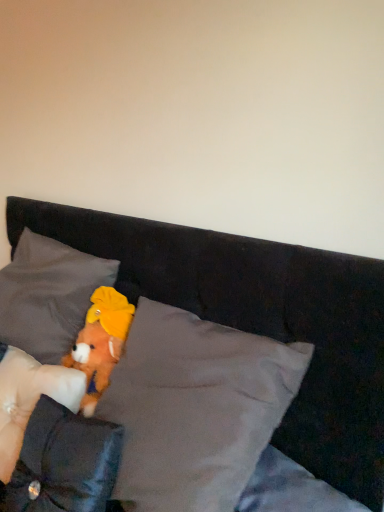
Question: Is dark gray plush pillow at left, the 3th pillow in the front-to-back sequence, positioned beyond the bounds of fluffy orange teddy bear at center?

Choices:
 (A) no
 (B) yes

Answer: (B)

Question: From a real-world perspective, is dark gray plush pillow at left, which is the first pillow from back to front, positioned under fluffy orange teddy bear at center based on gravity?

Choices:
 (A) yes
 (B) no

Answer: (B)

Question: Is dark gray plush pillow at left, the 3th pillow in the front-to-back sequence, oriented away from fluffy orange teddy bear at center?

Choices:
 (A) yes
 (B) no

Answer: (B)

Question: Can you confirm if dark gray plush pillow at left, the 3th pillow in the front-to-back sequence, is thinner than fluffy orange teddy bear at center?

Choices:
 (A) no
 (B) yes

Answer: (A)

Question: Is dark gray plush pillow at left, which is the first pillow from back to front, taller than fluffy orange teddy bear at center?

Choices:
 (A) yes
 (B) no

Answer: (A)

Question: Is dark gray plush pillow at left, which is the first pillow from back to front, inside or outside of fluffy orange teddy bear at center?

Choices:
 (A) inside
 (B) outside

Answer: (B)

Question: From the image's perspective, relative to fluffy orange teddy bear at center, is dark gray plush pillow at left, which is the first pillow from back to front, above or below?

Choices:
 (A) below
 (B) above

Answer: (B)

Question: Is point (43, 290) positioned closer to the camera than point (104, 313)?

Choices:
 (A) closer
 (B) farther

Answer: (B)

Question: From a real-world perspective, is dark gray plush pillow at left, which is the first pillow from back to front, above or below fluffy orange teddy bear at center?

Choices:
 (A) below
 (B) above

Answer: (B)

Question: Choose the correct answer: Is velvet gray pillow at lower left, the 1th pillow when ordered from front to back, inside soft white pillow at lower left, marked as the second pillow in a back-to-front arrangement, or outside it?

Choices:
 (A) outside
 (B) inside

Answer: (A)

Question: Considering the positions of velvet gray pillow at lower left, placed as the 3th pillow when sorted from back to front, and soft white pillow at lower left, marked as the second pillow in a back-to-front arrangement, in the image, is velvet gray pillow at lower left, placed as the 3th pillow when sorted from back to front, taller or shorter than soft white pillow at lower left, marked as the second pillow in a back-to-front arrangement,?

Choices:
 (A) short
 (B) tall

Answer: (B)

Question: Based on their positions, is velvet gray pillow at lower left, placed as the 3th pillow when sorted from back to front, located to the left or right of soft white pillow at lower left, the 2th pillow viewed from the front?

Choices:
 (A) left
 (B) right

Answer: (B)

Question: Considering the positions of point (57, 417) and point (77, 399), is point (57, 417) closer or farther from the camera than point (77, 399)?

Choices:
 (A) closer
 (B) farther

Answer: (A)

Question: Based on their sizes in the image, would you say velvet gray pillow at lower left, placed as the 3th pillow when sorted from back to front, is bigger or smaller than dark gray plush pillow at left, which is the first pillow from back to front?

Choices:
 (A) small
 (B) big

Answer: (A)

Question: In the image, is velvet gray pillow at lower left, placed as the 3th pillow when sorted from back to front, positioned in front of or behind dark gray plush pillow at left, which is the first pillow from back to front?

Choices:
 (A) front
 (B) behind

Answer: (A)